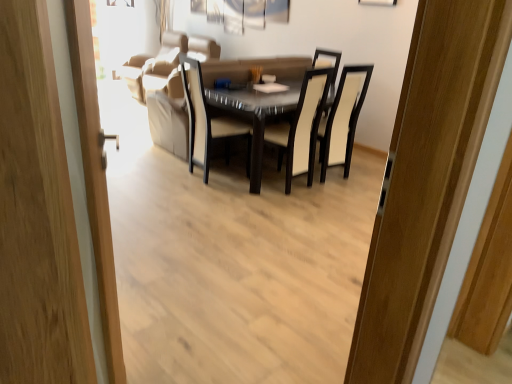
Image resolution: width=512 pixels, height=384 pixels. I want to click on vacant area that is situated to the right of black leather chair at center, the first chair from the right, so click(367, 179).